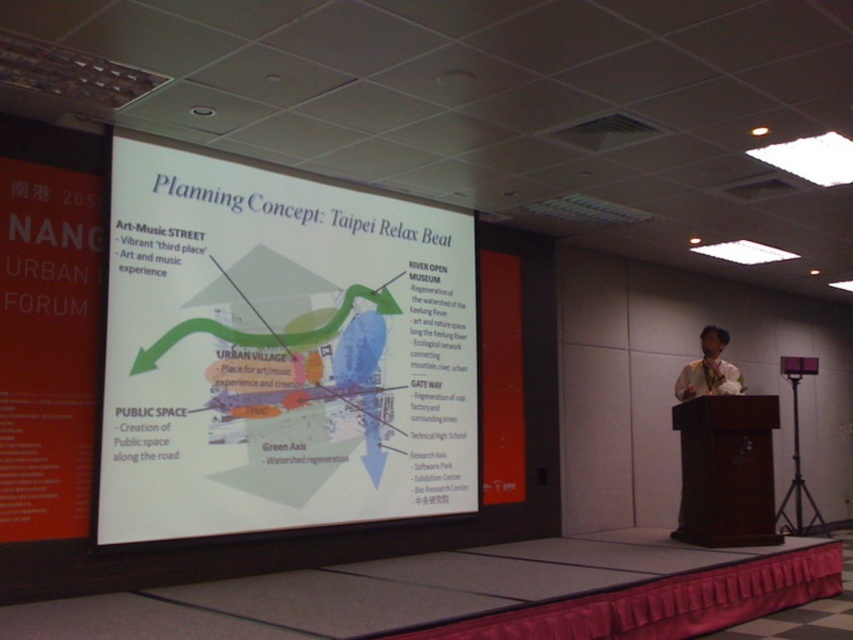
The width and height of the screenshot is (853, 640). What do you see at coordinates (279, 353) in the screenshot?
I see `white paper at center` at bounding box center [279, 353].

Is white paper at center wider than brown wooden podium at right?

Yes.

Is point (167, 410) closer to camera compared to point (766, 394)?

Yes, it is.

What are the coordinates of `white paper at center` in the screenshot? It's located at (279, 353).

Which is more to the left, brown wooden podium at right or matte white shirt at right?

Positioned to the left is brown wooden podium at right.

The image size is (853, 640). Describe the element at coordinates (726, 470) in the screenshot. I see `brown wooden podium at right` at that location.

Identify the location of brown wooden podium at right. (726, 470).

Between point (442, 448) and point (711, 378), which one is positioned behind?

The point (711, 378) is more distant.

Describe the element at coordinates (279, 353) in the screenshot. The height and width of the screenshot is (640, 853). I see `white paper at center` at that location.

This screenshot has height=640, width=853. I want to click on white paper at center, so click(x=279, y=353).